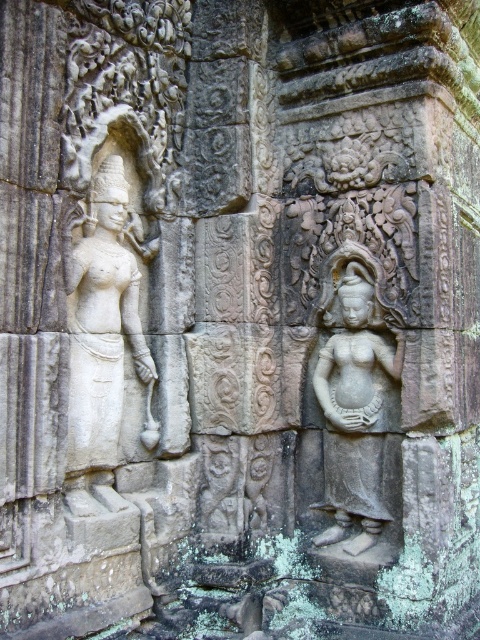
Question: From the image, what is the correct spatial relationship of white stone statue at left in relation to gray stone statue at center?

Choices:
 (A) left
 (B) right

Answer: (A)

Question: Considering the relative positions of white stone statue at left and gray stone statue at center in the image provided, where is white stone statue at left located with respect to gray stone statue at center?

Choices:
 (A) below
 (B) above

Answer: (B)

Question: Considering the relative positions of white stone statue at left and gray stone statue at center in the image provided, where is white stone statue at left located with respect to gray stone statue at center?

Choices:
 (A) left
 (B) right

Answer: (A)

Question: Among these objects, which one is nearest to the camera?

Choices:
 (A) white stone statue at left
 (B) gray stone statue at center

Answer: (A)

Question: Which object is farther from the camera taking this photo?

Choices:
 (A) gray stone statue at center
 (B) white stone statue at left

Answer: (A)

Question: Among these points, which one is farthest from the camera?

Choices:
 (A) (352, 352)
 (B) (120, 202)

Answer: (A)